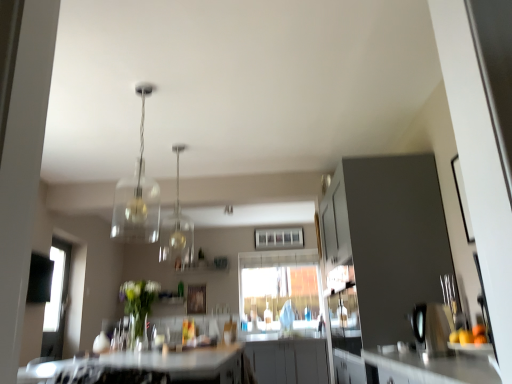
Question: Is white glossy countertop at lower center aimed at clear glass pendant light at center, the 1th light fixture viewed from the back?

Choices:
 (A) yes
 (B) no

Answer: (B)

Question: From a real-world perspective, is white glossy countertop at lower center beneath clear glass pendant light at center, which is counted as the 2th light fixture, starting from the front?

Choices:
 (A) yes
 (B) no

Answer: (A)

Question: Is white glossy countertop at lower center not inside clear glass pendant light at center, the 1th light fixture viewed from the back?

Choices:
 (A) no
 (B) yes

Answer: (B)

Question: Does white glossy countertop at lower center lie behind clear glass pendant light at center, the 1th light fixture viewed from the back?

Choices:
 (A) no
 (B) yes

Answer: (A)

Question: Is white glossy countertop at lower center at the left side of clear glass pendant light at center, the 1th light fixture viewed from the back?

Choices:
 (A) yes
 (B) no

Answer: (B)

Question: In terms of width, does clear glass pendant light at upper center, positioned as the first light fixture in front-to-back order, look wider or thinner when compared to transparent glass window at center, which appears as the 1th window when ordered from the bottom?

Choices:
 (A) thin
 (B) wide

Answer: (B)

Question: Which is correct: clear glass pendant light at upper center, marked as the 2th light fixture in a back-to-front arrangement, is inside transparent glass window at center, which appears as the 1th window when ordered from the bottom, or outside of it?

Choices:
 (A) inside
 (B) outside

Answer: (B)

Question: From the image's perspective, is clear glass pendant light at upper center, marked as the 2th light fixture in a back-to-front arrangement, positioned above or below transparent glass window at center, which appears as the 1th window when ordered from the bottom?

Choices:
 (A) below
 (B) above

Answer: (B)

Question: Is point (146, 198) positioned closer to the camera than point (297, 306)?

Choices:
 (A) closer
 (B) farther

Answer: (A)

Question: Is wooden cutting board at right bigger or smaller than clear glass pendant light at upper center, marked as the 2th light fixture in a back-to-front arrangement?

Choices:
 (A) small
 (B) big

Answer: (A)

Question: From the image's perspective, relative to clear glass pendant light at upper center, positioned as the first light fixture in front-to-back order, is wooden cutting board at right above or below?

Choices:
 (A) below
 (B) above

Answer: (A)

Question: Is point (441, 345) positioned closer to the camera than point (142, 200)?

Choices:
 (A) farther
 (B) closer

Answer: (B)

Question: Would you say wooden cutting board at right is inside or outside clear glass pendant light at upper center, marked as the 2th light fixture in a back-to-front arrangement?

Choices:
 (A) outside
 (B) inside

Answer: (A)

Question: Considering the relative positions of white glossy countertop at lower center and clear glass window at center, the 1th window positioned from the top, in the image provided, is white glossy countertop at lower center to the left or to the right of clear glass window at center, the 1th window positioned from the top,?

Choices:
 (A) right
 (B) left

Answer: (B)

Question: Considering the positions of white glossy countertop at lower center and clear glass window at center, positioned as the 2th window in bottom-to-top order, in the image, is white glossy countertop at lower center taller or shorter than clear glass window at center, positioned as the 2th window in bottom-to-top order,?

Choices:
 (A) tall
 (B) short

Answer: (B)